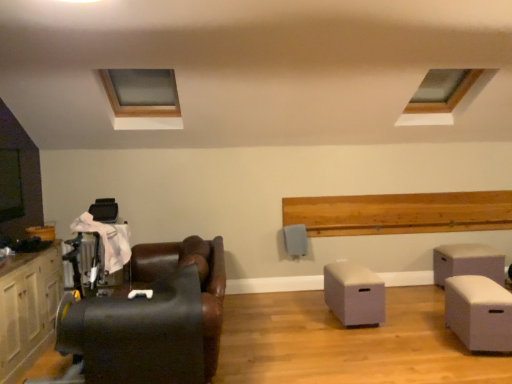
Question: From the image's perspective, would you say white matte storage box at lower right, the 2th table from the left, is positioned over black leather chair at left?

Choices:
 (A) yes
 (B) no

Answer: (B)

Question: From a real-world perspective, is white matte storage box at lower right, which appears as the third table when viewed from the back, physically below black leather chair at left?

Choices:
 (A) no
 (B) yes

Answer: (B)

Question: Considering the relative sizes of white matte storage box at lower right, placed as the 1th table when sorted from front to back, and black leather chair at left in the image provided, is white matte storage box at lower right, placed as the 1th table when sorted from front to back, bigger than black leather chair at left?

Choices:
 (A) yes
 (B) no

Answer: (B)

Question: Could you tell me if white matte storage box at lower right, which appears as the third table when viewed from the back, is facing black leather chair at left?

Choices:
 (A) yes
 (B) no

Answer: (A)

Question: Can you confirm if white matte storage box at lower right, the 2th table from the left, is wider than black leather chair at left?

Choices:
 (A) no
 (B) yes

Answer: (A)

Question: Is wooden frame at upper left taller or shorter than white matte storage box at center, acting as the second table starting from the front?

Choices:
 (A) tall
 (B) short

Answer: (A)

Question: From the image's perspective, is wooden frame at upper left above or below white matte storage box at center, marked as the first table in a left-to-right arrangement?

Choices:
 (A) below
 (B) above

Answer: (B)

Question: Relative to white matte storage box at center, marked as the first table in a left-to-right arrangement, is wooden frame at upper left in front or behind?

Choices:
 (A) front
 (B) behind

Answer: (A)

Question: Is wooden frame at upper left inside the boundaries of white matte storage box at center, acting as the second table starting from the front, or outside?

Choices:
 (A) inside
 (B) outside

Answer: (B)

Question: Is white matte storage box at lower right, placed as the 1th table when sorted from front to back, in front of or behind black leather chair at left in the image?

Choices:
 (A) front
 (B) behind

Answer: (B)

Question: From a real-world perspective, is white matte storage box at lower right, placed as the 1th table when sorted from front to back, physically located above or below black leather chair at left?

Choices:
 (A) above
 (B) below

Answer: (B)

Question: In terms of size, does white matte storage box at lower right, the 2th table from the left, appear bigger or smaller than black leather chair at left?

Choices:
 (A) small
 (B) big

Answer: (A)

Question: In terms of height, does white matte storage box at lower right, which appears as the third table when viewed from the back, look taller or shorter compared to black leather chair at left?

Choices:
 (A) short
 (B) tall

Answer: (A)

Question: From the image's perspective, is beige fabric ottoman at right, which is counted as the third table, starting from the left, above or below white matte storage box at center, acting as the 2th table starting from the back?

Choices:
 (A) above
 (B) below

Answer: (A)

Question: Considering their positions, is beige fabric ottoman at right, which is the 1th table from right to left, located in front of or behind white matte storage box at center, acting as the second table starting from the front?

Choices:
 (A) behind
 (B) front

Answer: (A)